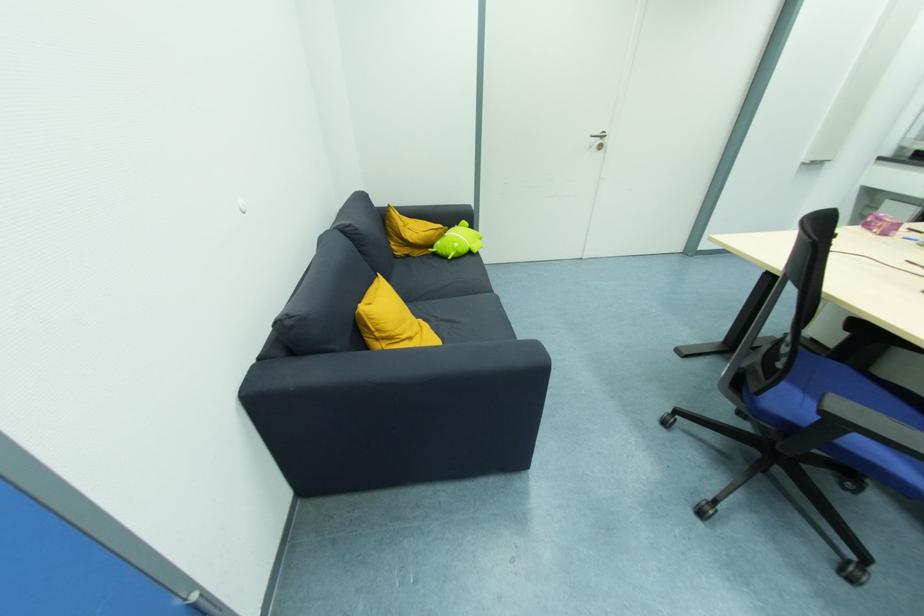
Image resolution: width=924 pixels, height=616 pixels. I want to click on white light switch, so click(239, 204).